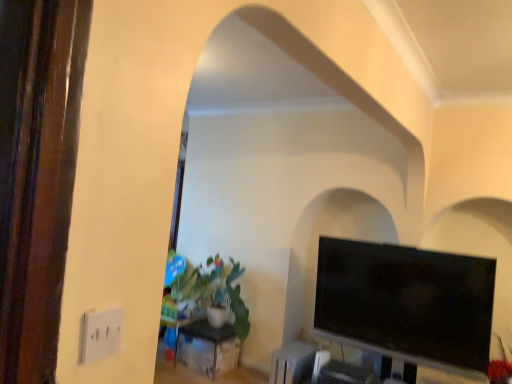
Question: Would you say green matte plant at center-left contains black glossy tv at right?

Choices:
 (A) no
 (B) yes

Answer: (A)

Question: From a real-world perspective, is green matte plant at center-left under black glossy tv at right?

Choices:
 (A) yes
 (B) no

Answer: (A)

Question: Is green matte plant at center-left turned away from black glossy tv at right?

Choices:
 (A) yes
 (B) no

Answer: (B)

Question: Considering the relative sizes of green matte plant at center-left and black glossy tv at right in the image provided, is green matte plant at center-left smaller than black glossy tv at right?

Choices:
 (A) yes
 (B) no

Answer: (B)

Question: From the image's perspective, does green matte plant at center-left appear higher than black glossy tv at right?

Choices:
 (A) no
 (B) yes

Answer: (A)

Question: In the image, is green matte plant at center-left on the left side or the right side of black glossy tv at right?

Choices:
 (A) right
 (B) left

Answer: (B)

Question: From the image's perspective, is green matte plant at center-left located above or below black glossy tv at right?

Choices:
 (A) above
 (B) below

Answer: (B)

Question: Is green matte plant at center-left wider or thinner than black glossy tv at right?

Choices:
 (A) wide
 (B) thin

Answer: (A)

Question: Is green matte plant at center-left inside or outside of black glossy tv at right?

Choices:
 (A) outside
 (B) inside

Answer: (A)

Question: Considering the positions of black glossy tv at right and green matte plant at center-left in the image, is black glossy tv at right wider or thinner than green matte plant at center-left?

Choices:
 (A) wide
 (B) thin

Answer: (B)

Question: Considering the positions of point (412, 324) and point (189, 286), is point (412, 324) closer or farther from the camera than point (189, 286)?

Choices:
 (A) closer
 (B) farther

Answer: (A)

Question: From the image's perspective, relative to green matte plant at center-left, is black glossy tv at right above or below?

Choices:
 (A) above
 (B) below

Answer: (A)

Question: Is black glossy tv at right to the left or to the right of green matte plant at center-left in the image?

Choices:
 (A) left
 (B) right

Answer: (B)

Question: Do you think black glossy tv at right is within black metal table at center, or outside of it?

Choices:
 (A) inside
 (B) outside

Answer: (B)

Question: Based on their positions, is black glossy tv at right located to the left or right of black metal table at center?

Choices:
 (A) right
 (B) left

Answer: (A)